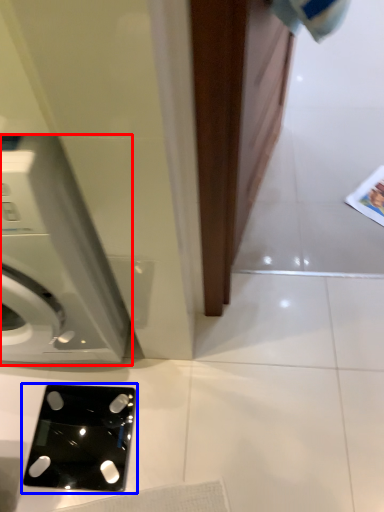
Question: Which object is further to the camera taking this photo, washing machine (highlighted by a red box) or ipod (highlighted by a blue box)?

Choices:
 (A) washing machine
 (B) ipod

Answer: (B)